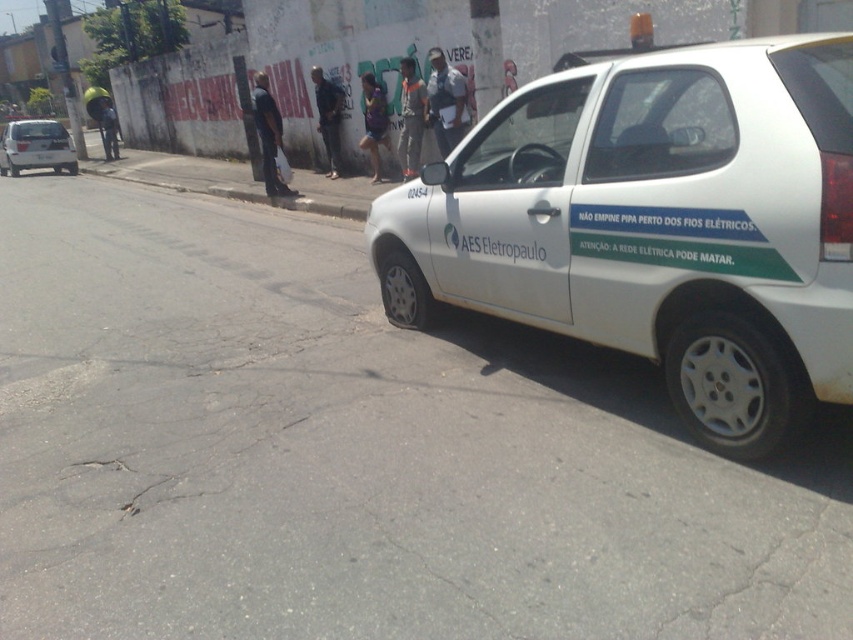
Is white matte car at right taller than white matte car at left?

In fact, white matte car at right may be shorter than white matte car at left.

Does white matte car at right appear over white matte car at left?

No.

Does point (531, 264) come behind point (67, 144)?

That is False.

What are the coordinates of `white matte car at right` in the screenshot? It's located at (656, 225).